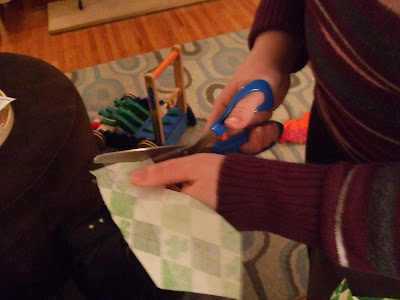
Locate an element on the screen. Image resolution: width=400 pixels, height=300 pixels. wooden floor is located at coordinates (182, 20).